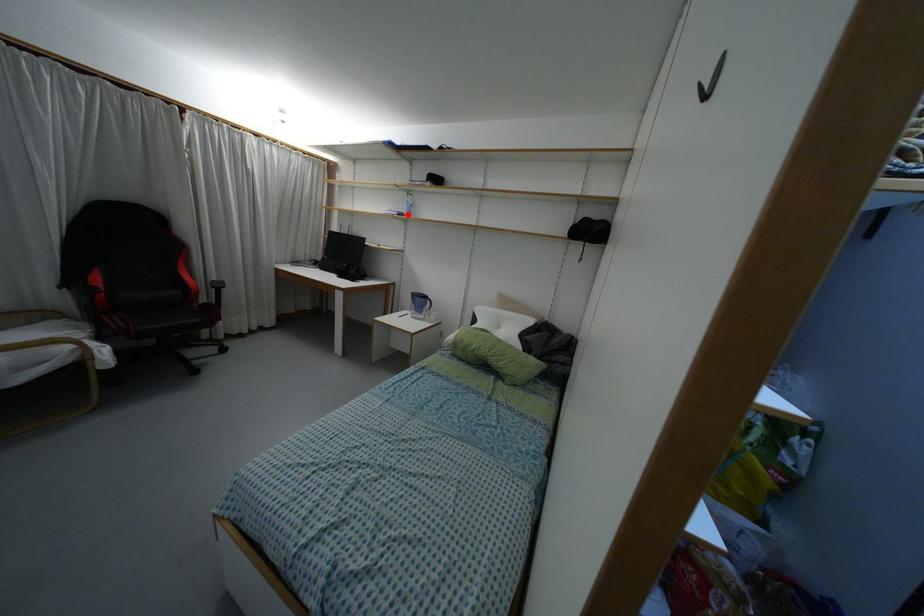
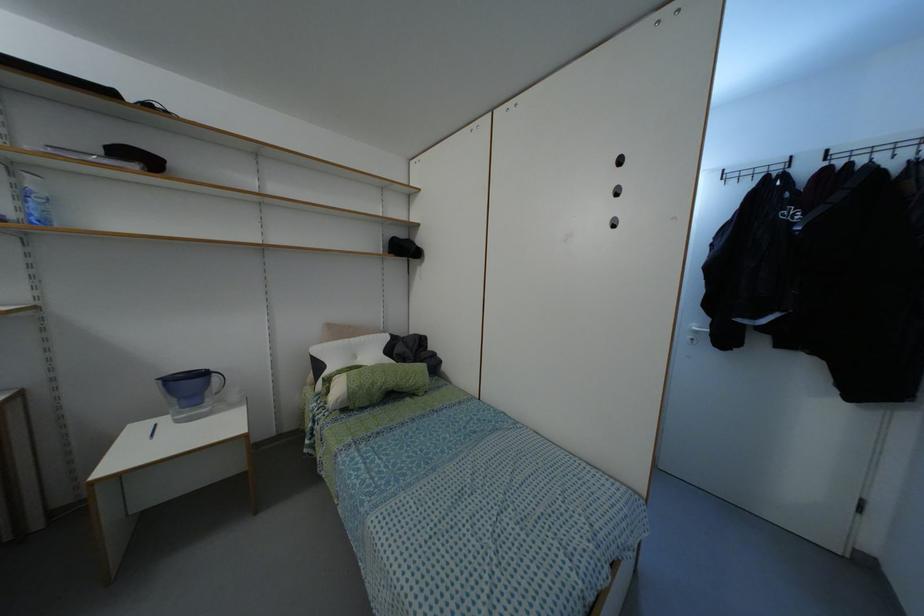
Where in the second image is the point corresponding to the highlighted location from the first image?

(44, 222)